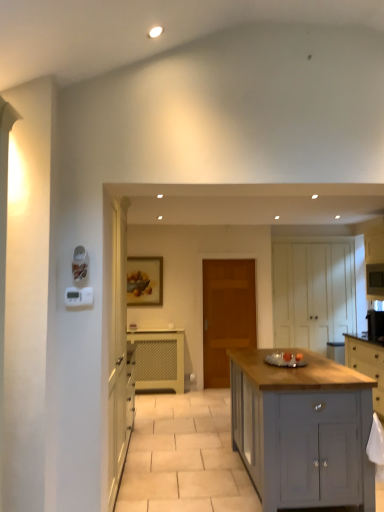
Question: Considering the relative sizes of white matte cabinet at right, the fifth cabinetry in the left-to-right sequence, and white glossy microwave at upper right in the image provided, is white matte cabinet at right, the fifth cabinetry in the left-to-right sequence, taller than white glossy microwave at upper right?

Choices:
 (A) yes
 (B) no

Answer: (A)

Question: From the image's perspective, would you say white matte cabinet at right, the fifth cabinetry in the left-to-right sequence, is shown under white glossy microwave at upper right?

Choices:
 (A) yes
 (B) no

Answer: (B)

Question: Can you confirm if white matte cabinet at right, the third cabinetry positioned from the back, is thinner than white glossy microwave at upper right?

Choices:
 (A) yes
 (B) no

Answer: (B)

Question: Could white glossy microwave at upper right be considered to be inside white matte cabinet at right, the fifth cabinetry in the left-to-right sequence?

Choices:
 (A) yes
 (B) no

Answer: (A)

Question: From the image's perspective, is white matte cabinet at right, the third cabinetry positioned from the back, on white glossy microwave at upper right?

Choices:
 (A) no
 (B) yes

Answer: (B)

Question: From a real-world perspective, is white matte cabinet at right, which ranks as the 1th cabinetry in right-to-left order, physically above white glossy microwave at upper right?

Choices:
 (A) no
 (B) yes

Answer: (B)

Question: Can you confirm if light gray wood cabinet at right, placed as the second cabinetry when sorted from front to back, is positioned to the right of wooden door at center?

Choices:
 (A) no
 (B) yes

Answer: (B)

Question: Is light gray wood cabinet at right, the fourth cabinetry in the back-to-front sequence, in contact with wooden door at center?

Choices:
 (A) yes
 (B) no

Answer: (B)

Question: From the image's perspective, is light gray wood cabinet at right, the 2th cabinetry positioned from the right, under wooden door at center?

Choices:
 (A) no
 (B) yes

Answer: (B)

Question: Does light gray wood cabinet at right, the fourth cabinetry in the back-to-front sequence, have a lesser height compared to wooden door at center?

Choices:
 (A) no
 (B) yes

Answer: (B)

Question: Is light gray wood cabinet at right, which is the fourth cabinetry from left to right, closer to the viewer compared to wooden door at center?

Choices:
 (A) no
 (B) yes

Answer: (B)

Question: Considering the relative sizes of light gray wood cabinet at right, placed as the second cabinetry when sorted from front to back, and wooden door at center in the image provided, is light gray wood cabinet at right, placed as the second cabinetry when sorted from front to back, smaller than wooden door at center?

Choices:
 (A) yes
 (B) no

Answer: (B)

Question: From a real-world perspective, is light gray wood cabinet at right, the 2th cabinetry positioned from the right, on white wood cabinet at center, arranged as the fifth cabinetry when viewed from the front?

Choices:
 (A) yes
 (B) no

Answer: (B)